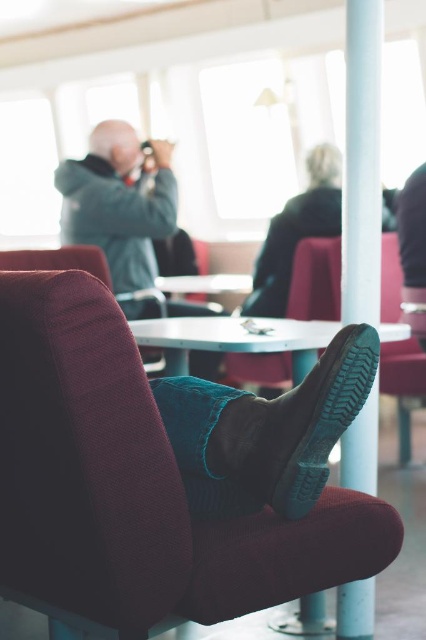
Is velvet-like maroon chair at lower left thinner than matte gray jacket at upper left?

Correct, velvet-like maroon chair at lower left's width is less than matte gray jacket at upper left's.

Does point (14, 412) lie behind point (86, 193)?

That is False.

Find the location of a particular element. This screenshot has height=640, width=426. velvet-like maroon chair at lower left is located at coordinates tap(135, 483).

Is velvet-like maroon chair at lower left above white glossy pole at center?

Incorrect, velvet-like maroon chair at lower left is not positioned above white glossy pole at center.

Is velvet-like maroon chair at lower left closer to camera compared to white glossy pole at center?

Yes, velvet-like maroon chair at lower left is in front of white glossy pole at center.

Where is `velvet-like maroon chair at lower left`? velvet-like maroon chair at lower left is located at coordinates (135, 483).

I want to click on velvet-like maroon chair at lower left, so click(x=135, y=483).

Is matte gray jacket at upper left taller than leather boot at lower center?

Indeed, matte gray jacket at upper left has a greater height compared to leather boot at lower center.

Which is more to the right, matte gray jacket at upper left or leather boot at lower center?

From the viewer's perspective, leather boot at lower center appears more on the right side.

Describe the element at coordinates (118, 204) in the screenshot. Image resolution: width=426 pixels, height=640 pixels. I see `matte gray jacket at upper left` at that location.

The width and height of the screenshot is (426, 640). In order to click on matte gray jacket at upper left in this screenshot , I will do `click(118, 204)`.